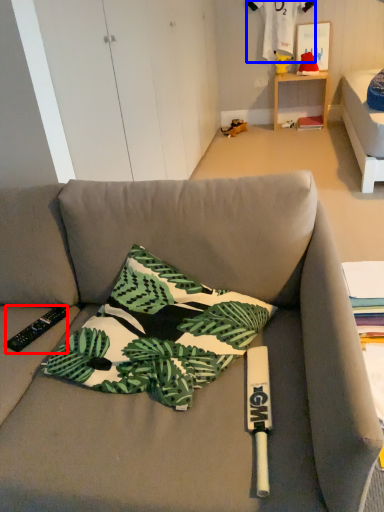
Question: Which of the following is the closest to the observer, remote control (highlighted by a red box) or fabric (highlighted by a blue box)?

Choices:
 (A) remote control
 (B) fabric

Answer: (A)